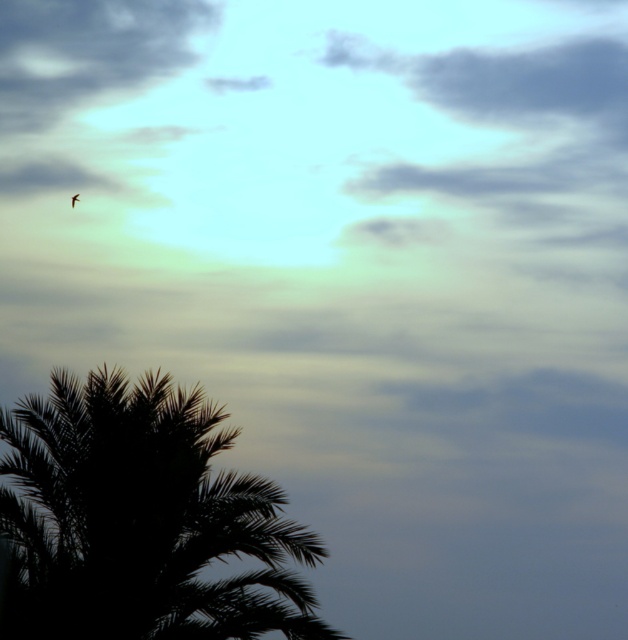
From the picture: You are a drone operator trying to capture a photo of the sky scene. Your drone is currently hovering at point coordinates of 0.5, 0.5. You want to move the drone to the black silhouette palm tree at lower left. What direction should you move the drone to reach the palm tree?

The black silhouette palm tree at lower left is located at point coordinates of [141,518]. Since the drone is at [314,320], it needs to move to the right and down to reach the palm tree. The x coordinate of the palm tree is higher than the drone, so move right, and the y coordinate is lower, so move down.

You are a bird watcher observing the sky scene. You notice the gray fluffy cloud at upper center and the brown feathered bird at upper left. How far apart are these two objects from each other?

The distance between the gray fluffy cloud at upper center and the brown feathered bird at upper left is 5.12 meters.

You are an observer looking at the sky scene. You notice the black silhouette palm tree at lower left and the brown feathered bird at upper left. Which object is positioned higher in the sky?

The brown feathered bird at upper left is positioned higher in the sky than the black silhouette palm tree at lower left.